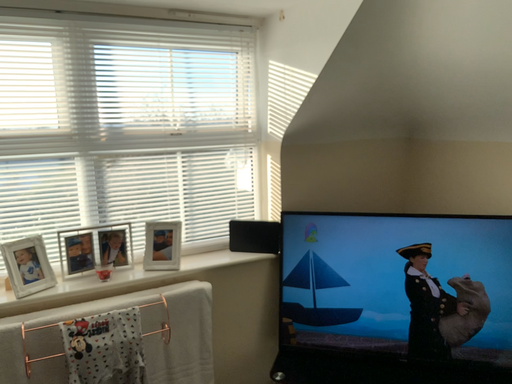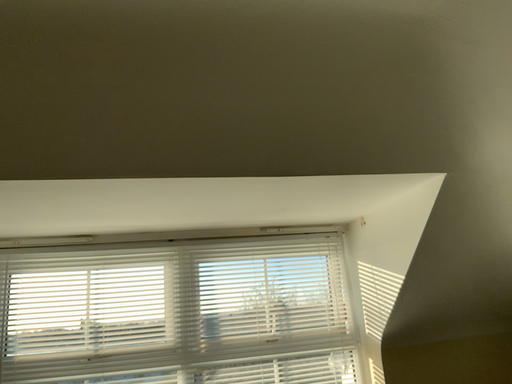
Question: How did the camera likely rotate when shooting the video?

Choices:
 (A) rotated left
 (B) rotated right

Answer: (A)